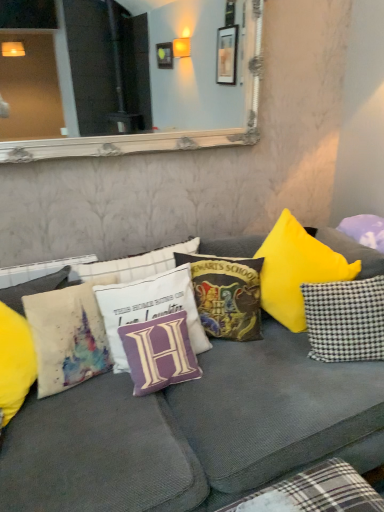
Question: Considering the relative sizes of purple fabric pillow at right, the 1th pillow when ordered from right to left, and watercolor fabric pillow at left, which is counted as the 6th pillow, starting from the right, in the image provided, is purple fabric pillow at right, the 1th pillow when ordered from right to left, wider than watercolor fabric pillow at left, which is counted as the 6th pillow, starting from the right,?

Choices:
 (A) no
 (B) yes

Answer: (B)

Question: Considering the relative sizes of purple fabric pillow at right, the 1th pillow when ordered from right to left, and watercolor fabric pillow at left, which is counted as the 6th pillow, starting from the right, in the image provided, is purple fabric pillow at right, the 1th pillow when ordered from right to left, shorter than watercolor fabric pillow at left, which is counted as the 6th pillow, starting from the right,?

Choices:
 (A) no
 (B) yes

Answer: (B)

Question: Considering the relative positions of purple fabric pillow at right, the sixth pillow when ordered from left to right, and watercolor fabric pillow at left, which is counted as the 6th pillow, starting from the right, in the image provided, is purple fabric pillow at right, the sixth pillow when ordered from left to right, to the right of watercolor fabric pillow at left, which is counted as the 6th pillow, starting from the right, from the viewer's perspective?

Choices:
 (A) no
 (B) yes

Answer: (B)

Question: Is purple fabric pillow at right, the 1th pillow when ordered from right to left, taller than watercolor fabric pillow at left, which is counted as the 6th pillow, starting from the right?

Choices:
 (A) yes
 (B) no

Answer: (B)

Question: Is purple fabric pillow at right, the sixth pillow when ordered from left to right, oriented towards watercolor fabric pillow at left, the first pillow from the left?

Choices:
 (A) yes
 (B) no

Answer: (A)

Question: From the image's perspective, is purple fabric pillow at right, the 1th pillow when ordered from right to left, on top of watercolor fabric pillow at left, which is counted as the 6th pillow, starting from the right?

Choices:
 (A) yes
 (B) no

Answer: (A)

Question: From the image's perspective, is velvet hogwarts school of witchcraft and wizardry pillow at center, the 3th pillow from the right, under watercolor fabric pillow at left, which is counted as the 6th pillow, starting from the right?

Choices:
 (A) no
 (B) yes

Answer: (A)

Question: Is velvet hogwarts school of witchcraft and wizardry pillow at center, the 3th pillow from the right, looking in the opposite direction of watercolor fabric pillow at left, which is counted as the 6th pillow, starting from the right?

Choices:
 (A) yes
 (B) no

Answer: (B)

Question: Can you confirm if velvet hogwarts school of witchcraft and wizardry pillow at center, the 3th pillow from the right, is thinner than watercolor fabric pillow at left, which is counted as the 6th pillow, starting from the right?

Choices:
 (A) yes
 (B) no

Answer: (A)

Question: Does velvet hogwarts school of witchcraft and wizardry pillow at center, the 3th pillow from the right, appear on the left side of watercolor fabric pillow at left, which is counted as the 6th pillow, starting from the right?

Choices:
 (A) yes
 (B) no

Answer: (B)

Question: Is velvet hogwarts school of witchcraft and wizardry pillow at center, the 4th pillow viewed from the left, positioned far away from watercolor fabric pillow at left, which is counted as the 6th pillow, starting from the right?

Choices:
 (A) no
 (B) yes

Answer: (A)

Question: Would you say velvet hogwarts school of witchcraft and wizardry pillow at center, the 4th pillow viewed from the left, contains watercolor fabric pillow at left, the first pillow from the left?

Choices:
 (A) yes
 (B) no

Answer: (B)

Question: Can you confirm if white textured mirror at upper center is smaller than white fabric pillow with purple letter h at center, the 5th pillow when ordered from right to left?

Choices:
 (A) yes
 (B) no

Answer: (B)